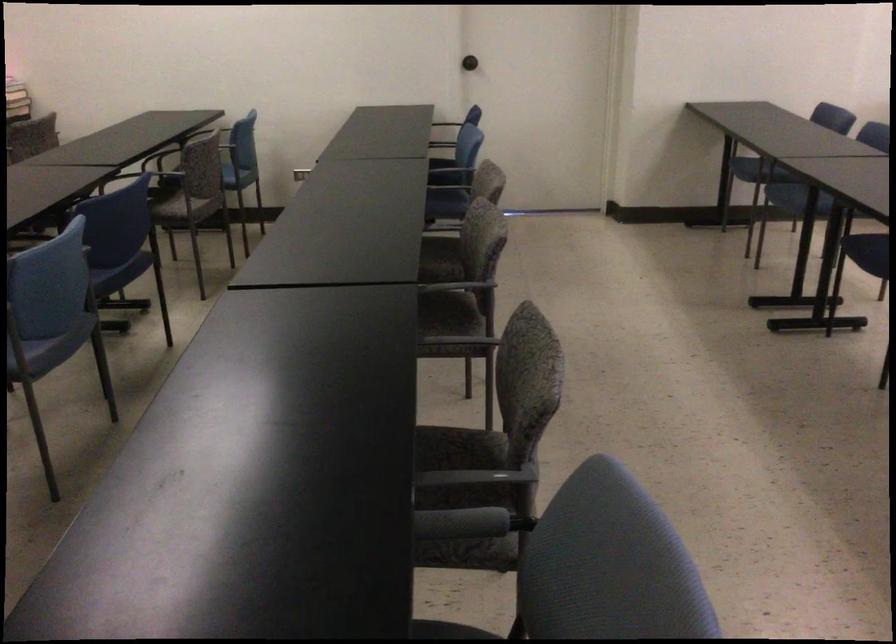
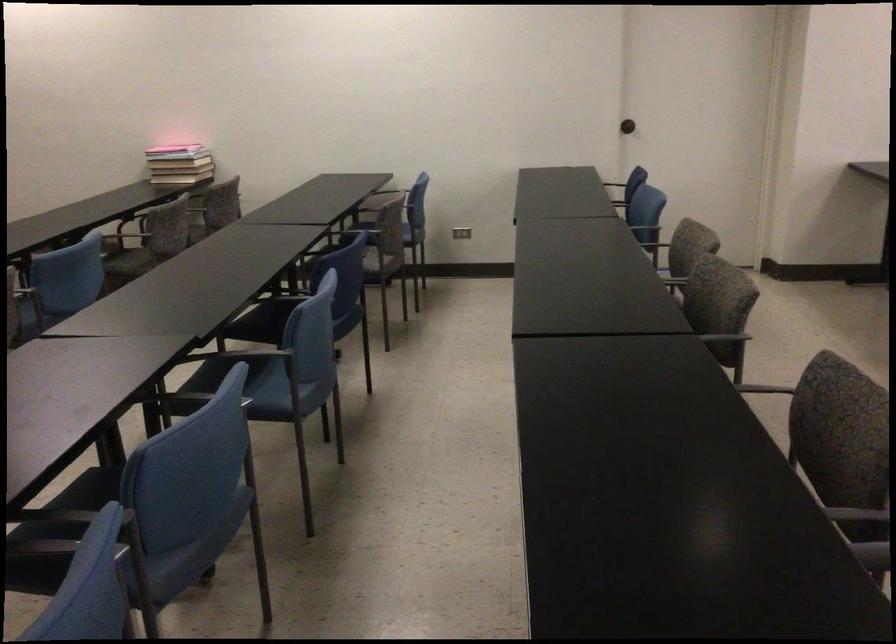
Find the pixel in the second image that matches [204,167] in the first image.

(398, 225)